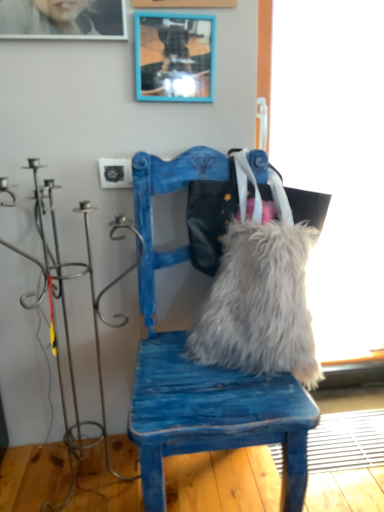
Question: In terms of size, does blue distressed wood chair at center appear bigger or smaller than blue painted wood picture frame at upper center?

Choices:
 (A) small
 (B) big

Answer: (B)

Question: From a real-world perspective, is blue distressed wood chair at center positioned above or below blue painted wood picture frame at upper center?

Choices:
 (A) below
 (B) above

Answer: (A)

Question: Estimate the real-world distances between objects in this image. Which object is farther from the white fluffy pillow at center?

Choices:
 (A) blue distressed wood chair at center
 (B) blue painted wood picture frame at upper center
 (C) fuzzy fabric messenger bag at center

Answer: (B)

Question: Which is nearer to the blue painted wood picture frame at upper center?

Choices:
 (A) fuzzy fabric messenger bag at center
 (B) blue distressed wood chair at center
 (C) white fluffy pillow at center

Answer: (A)